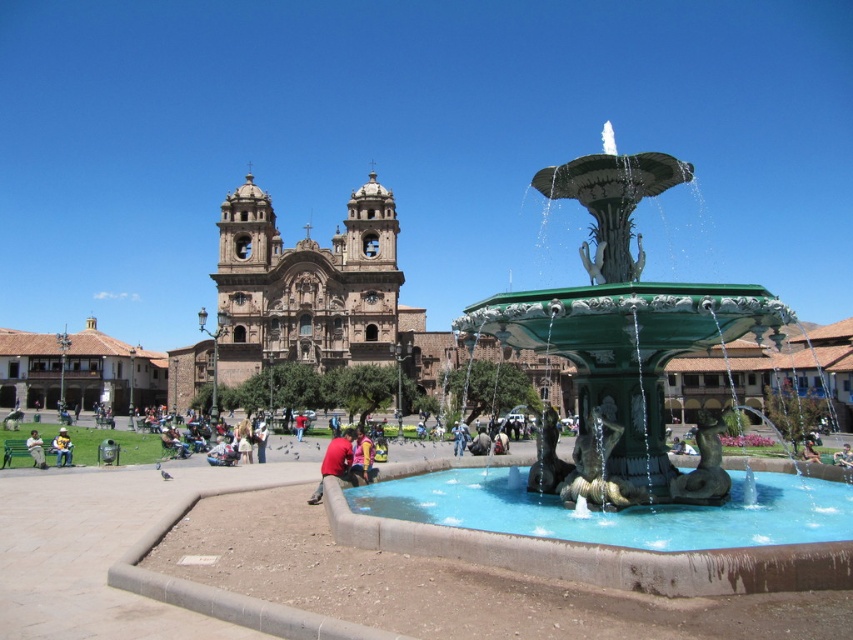
You are standing in the public square and want to take a photo of both point (671,344) and point (358,436) in the frame. Which point is closer to your camera?

Point (671,344) is closer to the camera than point (358,436).

In the scene shown: You are a tourist standing in the public square and want to take a photo of both the green stone fountain at center and the pink fabric at center. Which object should you focus on first to ensure both are in frame?

You should focus on the green stone fountain at center first because it is taller than the pink fabric at center. Since it is taller, positioning your camera to include its full height will naturally accommodate the shorter pink fabric at center within the frame.